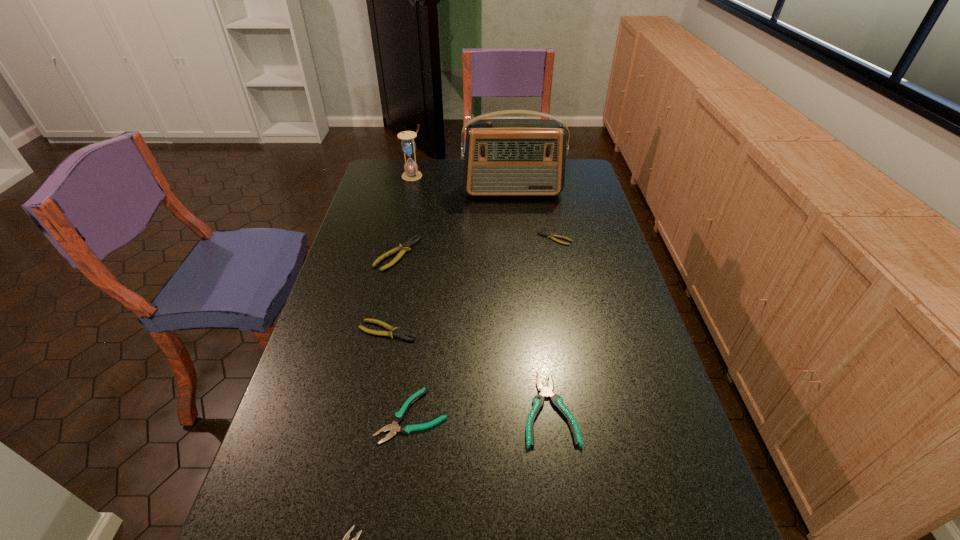
Identify the location of free point between the second biggest teal pliers and the smallest yellow pliers. Image resolution: width=960 pixels, height=540 pixels. (484, 327).

The width and height of the screenshot is (960, 540). Identify the location of unoccupied position between the tallest object and the third tallest object. (455, 222).

Where is `free space between the seventh nearest object and the biggest yellow pliers`? free space between the seventh nearest object and the biggest yellow pliers is located at coordinates (455, 222).

What are the coordinates of `vacant region between the sixth shortest object and the fourth nearest object` in the screenshot? It's located at click(x=393, y=292).

Locate an element on the screen. This screenshot has height=540, width=960. empty space between the biggest teal pliers and the radio receiver is located at coordinates (531, 300).

The width and height of the screenshot is (960, 540). Find the location of `empty space between the rightmost yellow pliers and the nearest yellow pliers`. empty space between the rightmost yellow pliers and the nearest yellow pliers is located at coordinates (471, 285).

Identify which object is the seventh closest to the fifth farthest object. Please provide its 2D coordinates. Your answer should be formatted as a tuple, i.e. [(x, y)], where the tuple contains the x and y coordinates of a point satisfying the conditions above.

[(408, 145)]

Select which object appears as the sixth closest to the second tallest object. Please provide its 2D coordinates. Your answer should be formatted as a tuple, i.e. [(x, y)], where the tuple contains the x and y coordinates of a point satisfying the conditions above.

[(545, 391)]

Where is `pliers that stands as the second closest to the hourglass`? pliers that stands as the second closest to the hourglass is located at coordinates (551, 236).

You are a GUI agent. You are given a task and a screenshot of the screen. Output one action in this format:
    pyautogui.click(x=<x>, y=<y>)
    Task: Click on the pliers that is the fifth nearest to the biggest yellow pliers
    The image size is (960, 540).
    Given the screenshot: What is the action you would take?
    pyautogui.click(x=347, y=535)